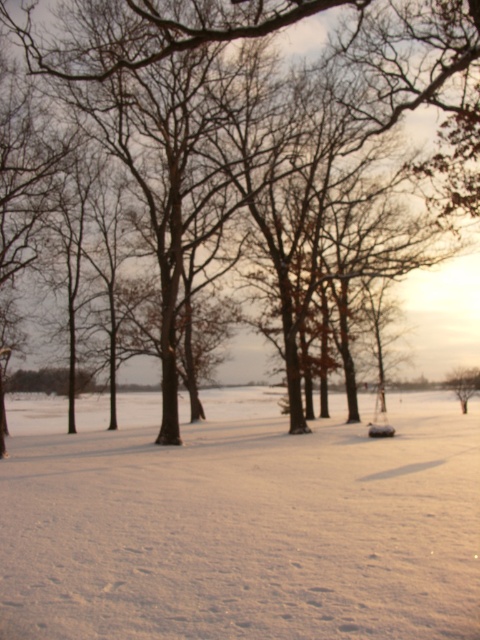
You are standing in the winter scene and want to walk towards the white powdery snow at center. Which direction should you head relative to the brown bark tree at center?

The white powdery snow at center is to the right of the brown bark tree at center, so you should head to the right of the brown bark tree at center to reach it.

Looking at this image, you are an explorer trying to cross the white powdery snow at center. You have a 5 meter long rope. Can you safely cross the gap between the two trees using the rope?

The gap between the two trees is 4.87 meters, so the 5 meter long rope is sufficient to safely cross the gap between the two trees.

You are standing at the origin point of the image. You want to walk to the white powdery snow at center. Which direction should you go?

The white powdery snow at center is located at point 0.814 on the x axis and 0.500 on the y axis. Since you are at the origin point, you should move towards the right direction along the x axis to reach it.